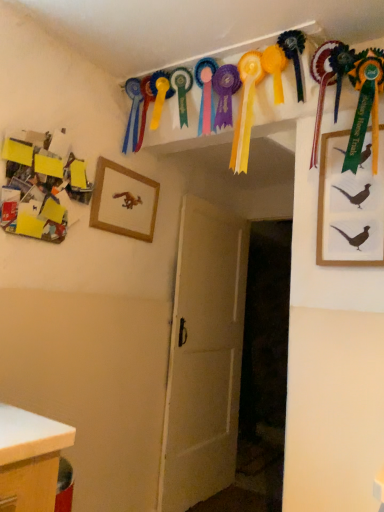
Question: Is silk green ribbon at upper right, arranged as the 1th picture frame when viewed from the right, to the left of wooden picture frame at center-left, arranged as the second picture frame when viewed from the right, from the viewer's perspective?

Choices:
 (A) no
 (B) yes

Answer: (A)

Question: Is silk green ribbon at upper right, placed as the first picture frame when sorted from front to back, oriented towards wooden picture frame at center-left, arranged as the 1th picture frame when viewed from the left?

Choices:
 (A) yes
 (B) no

Answer: (B)

Question: Is silk green ribbon at upper right, the second picture frame viewed from the left, to the right of wooden picture frame at center-left, arranged as the second picture frame when viewed from the right, from the viewer's perspective?

Choices:
 (A) no
 (B) yes

Answer: (B)

Question: From the image's perspective, is silk green ribbon at upper right, which ranks as the second picture frame in back-to-front order, below wooden picture frame at center-left, which is the 2th picture frame in front-to-back order?

Choices:
 (A) yes
 (B) no

Answer: (A)

Question: From the image's perspective, is silk green ribbon at upper right, which ranks as the second picture frame in back-to-front order, over wooden picture frame at center-left, which is the 2th picture frame in front-to-back order?

Choices:
 (A) yes
 (B) no

Answer: (B)

Question: Does silk green ribbon at upper right, the second picture frame viewed from the left, have a lesser height compared to wooden picture frame at center-left, which is the 1th picture frame from back to front?

Choices:
 (A) no
 (B) yes

Answer: (A)

Question: Is silk green ribbon at upper right, placed as the first picture frame when sorted from front to back, shorter than white wooden door at center?

Choices:
 (A) yes
 (B) no

Answer: (A)

Question: Considering the relative positions of silk green ribbon at upper right, which ranks as the second picture frame in back-to-front order, and white wooden door at center in the image provided, is silk green ribbon at upper right, which ranks as the second picture frame in back-to-front order, in front of white wooden door at center?

Choices:
 (A) no
 (B) yes

Answer: (B)

Question: Is silk green ribbon at upper right, arranged as the 1th picture frame when viewed from the right, turned away from white wooden door at center?

Choices:
 (A) yes
 (B) no

Answer: (B)

Question: Is silk green ribbon at upper right, arranged as the 1th picture frame when viewed from the right, not near white wooden door at center?

Choices:
 (A) yes
 (B) no

Answer: (A)

Question: Is white wooden door at center inside silk green ribbon at upper right, which ranks as the second picture frame in back-to-front order?

Choices:
 (A) yes
 (B) no

Answer: (B)

Question: From the image's perspective, does silk green ribbon at upper right, placed as the first picture frame when sorted from front to back, appear lower than white wooden door at center?

Choices:
 (A) no
 (B) yes

Answer: (A)

Question: Are white wooden door at center and wooden picture frame at center-left, arranged as the second picture frame when viewed from the right, beside each other?

Choices:
 (A) yes
 (B) no

Answer: (B)